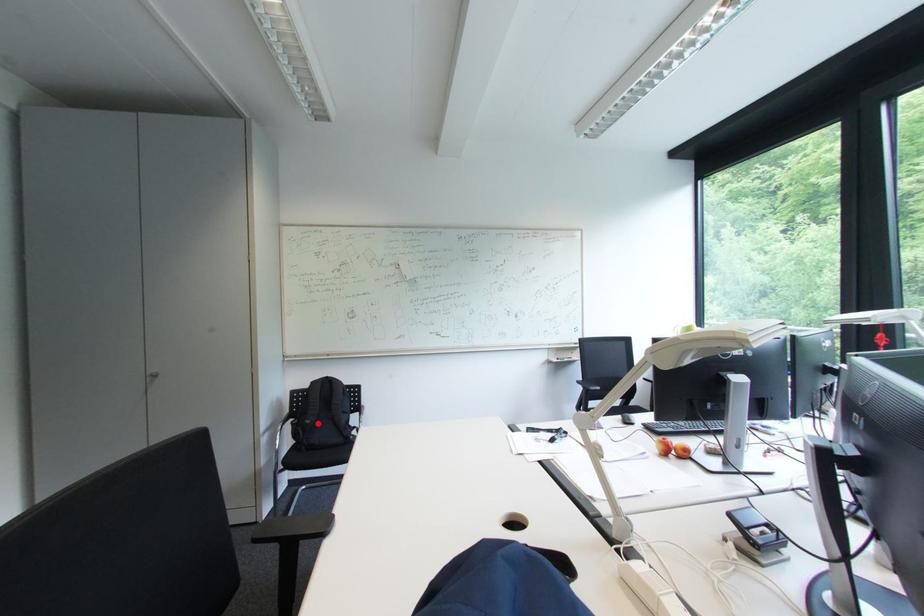
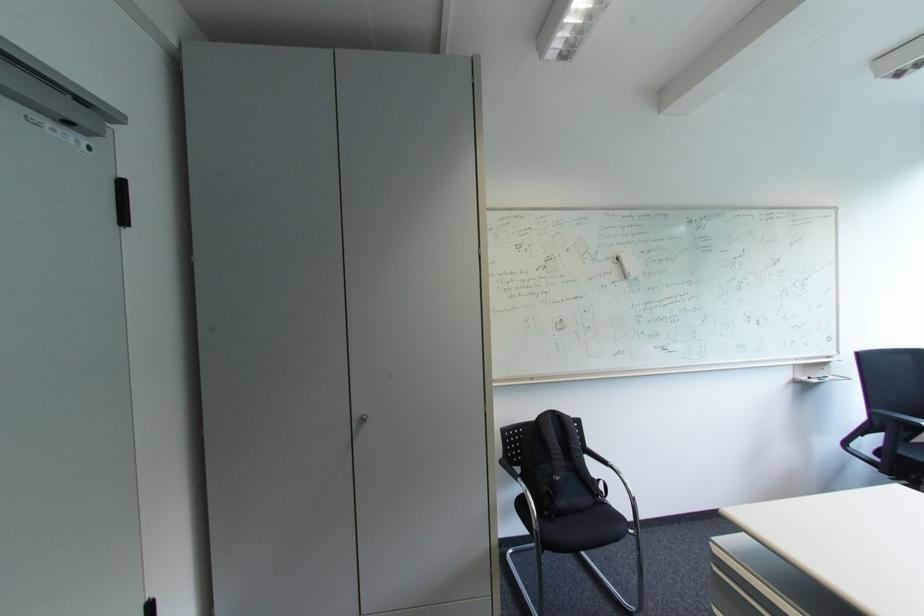
Locate, in the second image, the point that corresponds to the highlighted location in the first image.

(566, 480)